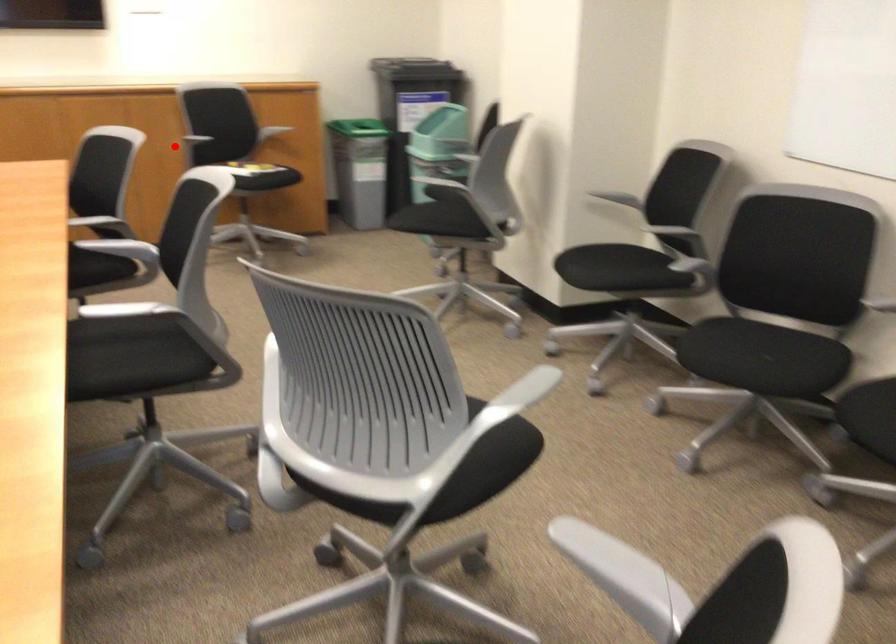
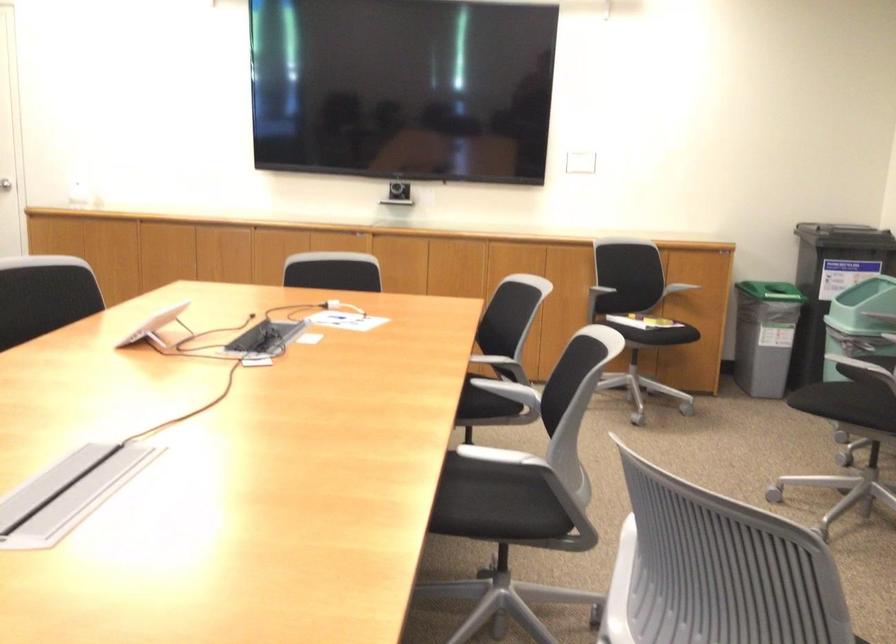
The point at the highlighted location is marked in the first image. Where is the corresponding point in the second image?

(571, 290)